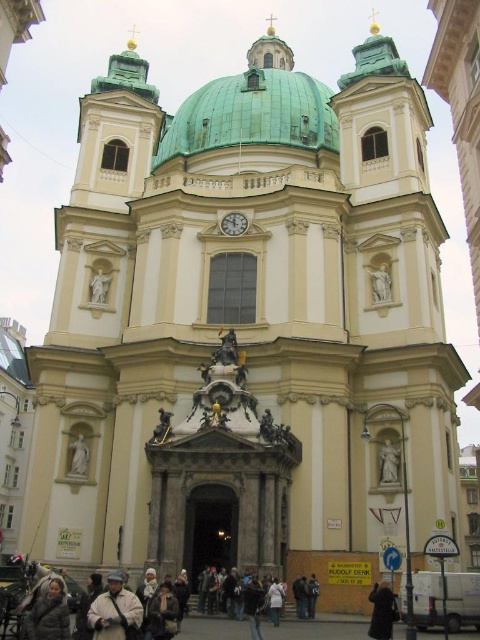
Question: Does green copper dome at upper center appear on the right side of white marble statue at upper left?

Choices:
 (A) no
 (B) yes

Answer: (B)

Question: Is gray wool coat at lower left thinner than matte gold clock at center?

Choices:
 (A) yes
 (B) no

Answer: (A)

Question: Is gray wool coat at lower left thinner than white marble statue at lower right?

Choices:
 (A) yes
 (B) no

Answer: (A)

Question: Which object is the closest to the white marble statue at lower right?

Choices:
 (A) matte gold clock at center
 (B) black leather coat at lower center
 (C) white marble statue at upper right
 (D) light brown leather jacket at lower center

Answer: (B)

Question: Which point is farther to the camera?

Choices:
 (A) (107, 627)
 (B) (103, 276)
 (C) (300, 109)
 (D) (48, 592)

Answer: (C)

Question: Which point is farther from the camera taking this photo?

Choices:
 (A) (245, 224)
 (B) (97, 301)
 (C) (74, 449)
 (D) (59, 616)

Answer: (A)